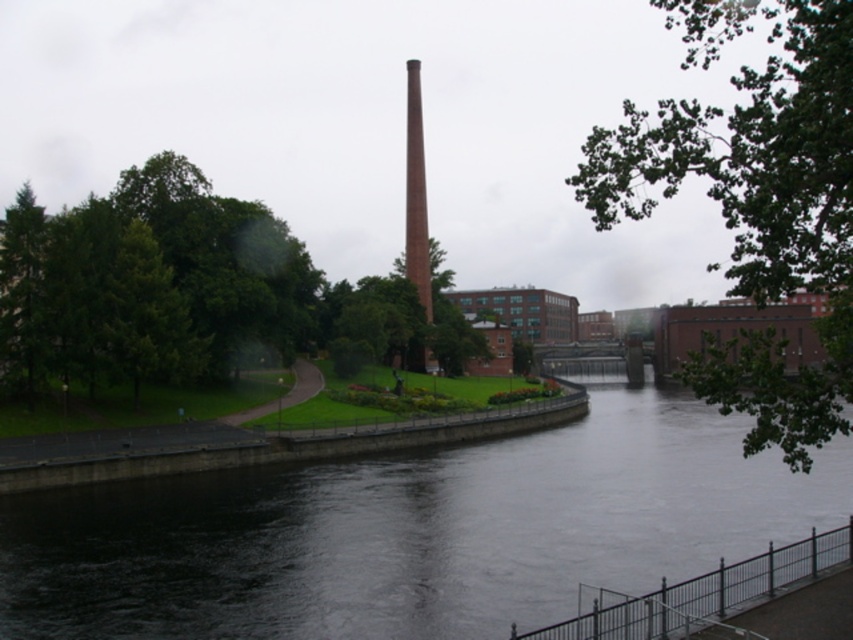
Between point (744, 166) and point (422, 141), which one is positioned in front?

Point (744, 166)

Between green leafy tree at upper right and red brick chimney at center, which one is positioned lower?

Positioned lower is green leafy tree at upper right.

Find the location of a particular element. This screenshot has height=640, width=853. green leafy tree at upper right is located at coordinates (756, 204).

Where is `green leafy tree at upper right`? The width and height of the screenshot is (853, 640). green leafy tree at upper right is located at coordinates click(756, 204).

What do you see at coordinates (186, 291) in the screenshot?
I see `green leafy tree at center` at bounding box center [186, 291].

Who is more distant from viewer, (44, 380) or (410, 176)?

Point (410, 176)

The height and width of the screenshot is (640, 853). In order to click on green leafy tree at center in this screenshot , I will do `click(186, 291)`.

Is point (128, 326) positioned in front of point (804, 422)?

No.

Is green leafy tree at center taller than green leafy tree at upper right?

No.

Is point (39, 320) positioned before point (822, 234)?

No, it is not.

You are a GUI agent. You are given a task and a screenshot of the screen. Output one action in this format:
    pyautogui.click(x=<x>, y=<y>)
    Task: Click on the green leafy tree at center
    The width and height of the screenshot is (853, 640).
    Given the screenshot: What is the action you would take?
    pyautogui.click(x=186, y=291)